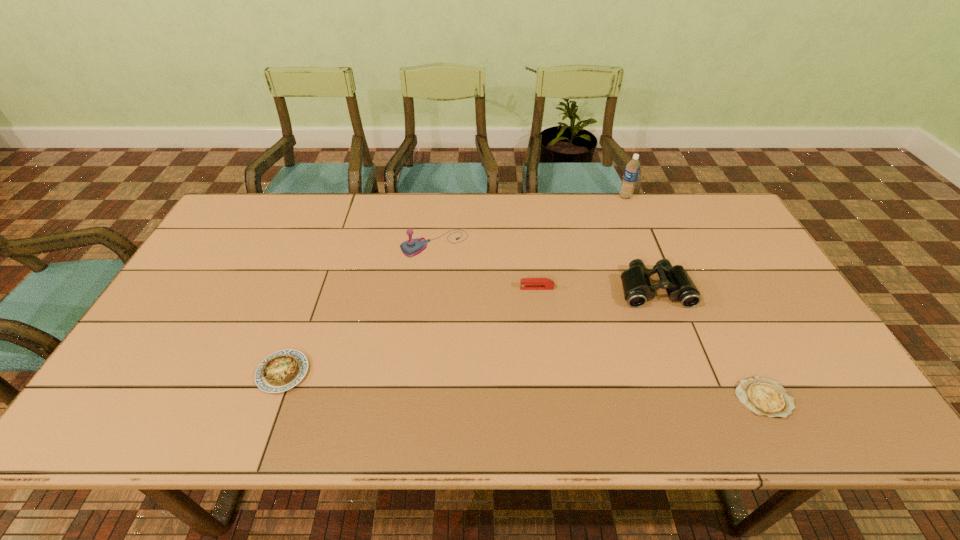
I want to click on free space between the farthest object and the fifth object from right to left, so click(x=530, y=220).

Image resolution: width=960 pixels, height=540 pixels. I want to click on free area in between the second farthest object and the shorter quiche, so click(599, 321).

Locate an element on the screen. free space between the stapler and the binoculars is located at coordinates (595, 288).

Locate an element on the screen. The width and height of the screenshot is (960, 540). free spot between the third shortest object and the left quiche is located at coordinates (410, 330).

The image size is (960, 540). What are the coordinates of `empty space between the binoculars and the water bottle` in the screenshot? It's located at (639, 242).

You are a GUI agent. You are given a task and a screenshot of the screen. Output one action in this format:
    pyautogui.click(x=<x>, y=<y>)
    Task: Click on the blank region between the leftmost object and the water bottle
    The height and width of the screenshot is (540, 960).
    Given the screenshot: What is the action you would take?
    pyautogui.click(x=454, y=285)

Where is `vacant space that is in between the binoculars and the fifth nearest object`? The image size is (960, 540). vacant space that is in between the binoculars and the fifth nearest object is located at coordinates (544, 266).

You are a GUI agent. You are given a task and a screenshot of the screen. Output one action in this format:
    pyautogui.click(x=<x>, y=<y>)
    Task: Click on the blank region between the second farthest object and the water bottle
    The image size is (960, 540).
    Given the screenshot: What is the action you would take?
    pyautogui.click(x=530, y=220)

You are a GUI agent. You are given a task and a screenshot of the screen. Output one action in this format:
    pyautogui.click(x=<x>, y=<y>)
    Task: Click on the vacant space in between the fourth tallest object and the second object from left to right
    The height and width of the screenshot is (540, 960).
    Given the screenshot: What is the action you would take?
    pyautogui.click(x=486, y=266)

Image resolution: width=960 pixels, height=540 pixels. What are the coordinates of `object that can be found as the closest to the binoculars` in the screenshot? It's located at pos(526,283).